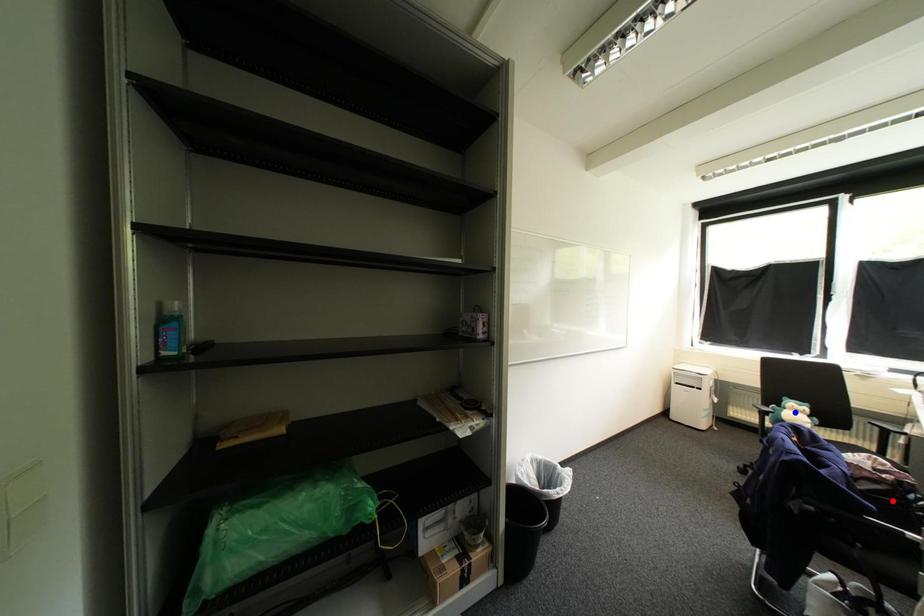
Question: In the image, two points are highlighted. Which point is nearer to the camera? Reply with the corresponding letter.

Choices:
 (A) blue point
 (B) red point

Answer: (B)